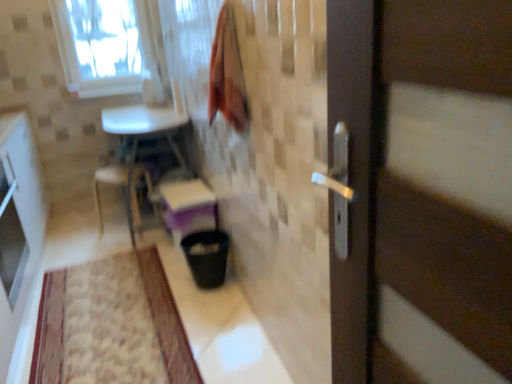
Question: Is point (7, 246) closer or farther from the camera than point (95, 36)?

Choices:
 (A) closer
 (B) farther

Answer: (A)

Question: In terms of size, does white glossy cabinet at left appear bigger or smaller than transparent glass window at upper left?

Choices:
 (A) big
 (B) small

Answer: (A)

Question: Estimate the real-world distances between objects in this image. Which object is farther from the white plastic chair at lower left?

Choices:
 (A) velvet pink blanket at upper center
 (B) white glossy cabinet at left
 (C) transparent glass window at upper left
 (D) matte white step stool at center
 (E) black plastic trash can at lower center

Answer: (A)

Question: Considering the real-world distances, which object is closest to the beige textured mat at lower left?

Choices:
 (A) white glossy cabinet at left
 (B) velvet pink blanket at upper center
 (C) matte white step stool at center
 (D) black plastic trash can at lower center
 (E) transparent glass window at upper left

Answer: (D)